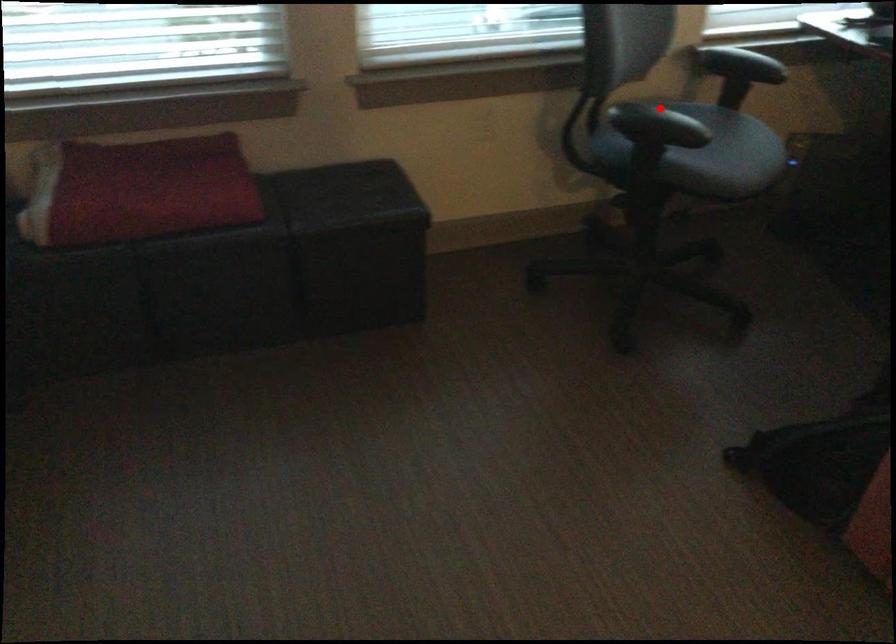
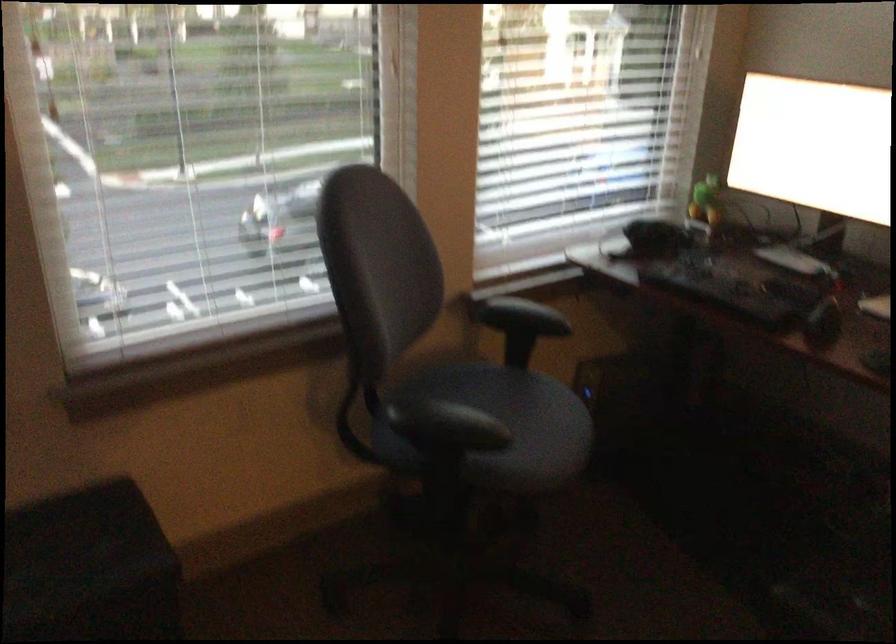
Question: I am providing you with two images of the same scene from different viewpoints. In image1, a red point is highlighted. Considering the same 3D point in image2, which of the following is correct?

Choices:
 (A) It is closer
 (B) It is farther

Answer: (A)